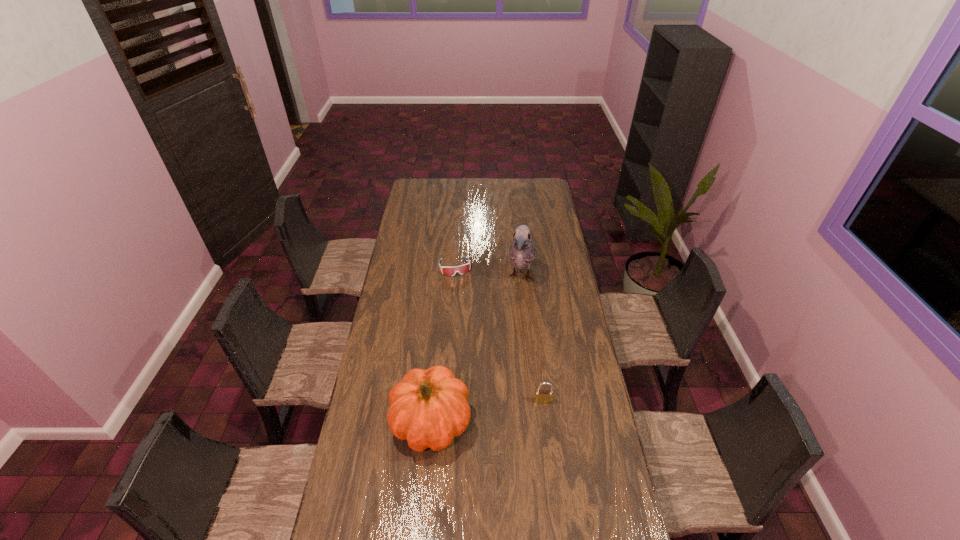
Image resolution: width=960 pixels, height=540 pixels. Find the location of `the third shortest object`. the third shortest object is located at coordinates [430, 407].

At what (x,y) coordinates should I click in order to perform the action: click on the second shortest object. Please return your answer as a coordinate pair (x, y). This screenshot has width=960, height=540. Looking at the image, I should click on (541, 396).

The image size is (960, 540). Find the location of `parrot`. parrot is located at coordinates point(522,250).

This screenshot has height=540, width=960. I want to click on goggles, so click(x=462, y=269).

What are the coordinates of `free space located on the back of the pumpkin` in the screenshot? It's located at (438, 346).

This screenshot has height=540, width=960. Find the location of `free space located on the front-facing side of the third tallest object`. free space located on the front-facing side of the third tallest object is located at coordinates (556, 509).

Identify the location of free space located on the front-facing side of the parrot. (512, 336).

Find the location of `vacant space situated on the front-facing side of the parrot`. vacant space situated on the front-facing side of the parrot is located at coordinates (506, 361).

You are a GUI agent. You are given a task and a screenshot of the screen. Output one action in this format:
    pyautogui.click(x=<x>, y=<y>)
    Task: Click on the free region located 0.230m on the front-facing side of the parrot
    
    Given the screenshot: What is the action you would take?
    512,334

This screenshot has width=960, height=540. I want to click on vacant space positioned on the front-facing side of the shortest object, so [x=468, y=316].